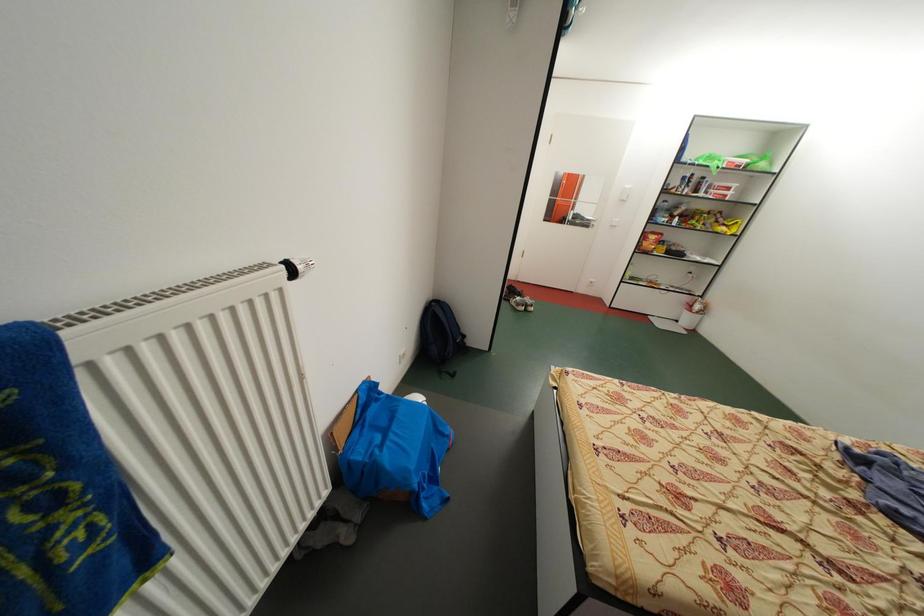
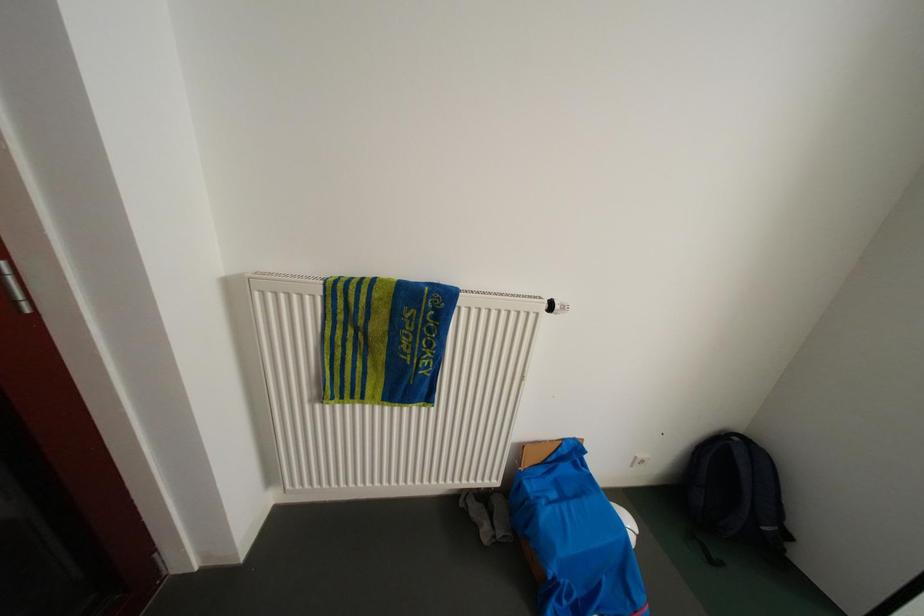
Question: The camera is either moving clockwise (left) or counter-clockwise (right) around the object. The first image is from the beginning of the video and the second image is from the end. Is the camera moving left or right when shooting the video?

Choices:
 (A) Left
 (B) Right

Answer: (B)